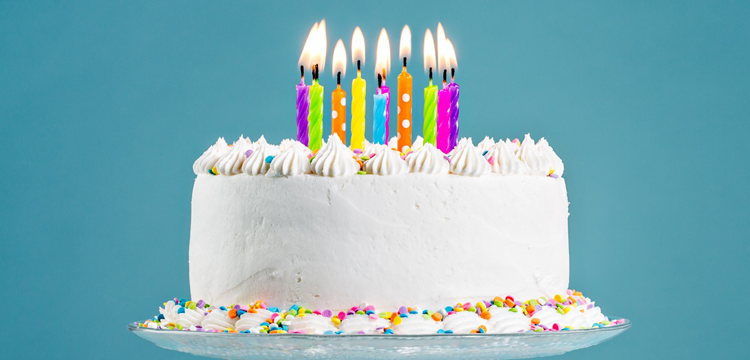
Find the location of a particular element. candle is located at coordinates (300, 103), (313, 105), (340, 108), (360, 116), (379, 107), (385, 88), (400, 98), (427, 114), (442, 118), (452, 118).